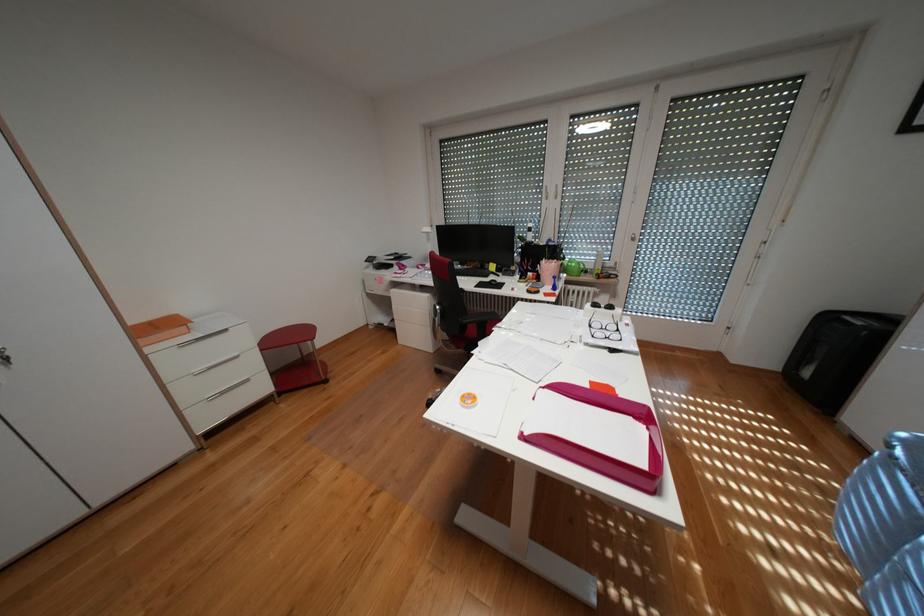
Where would you resting arm the black chair armrest? Please return your answer as a coordinate pair (x, y).

(480, 318)